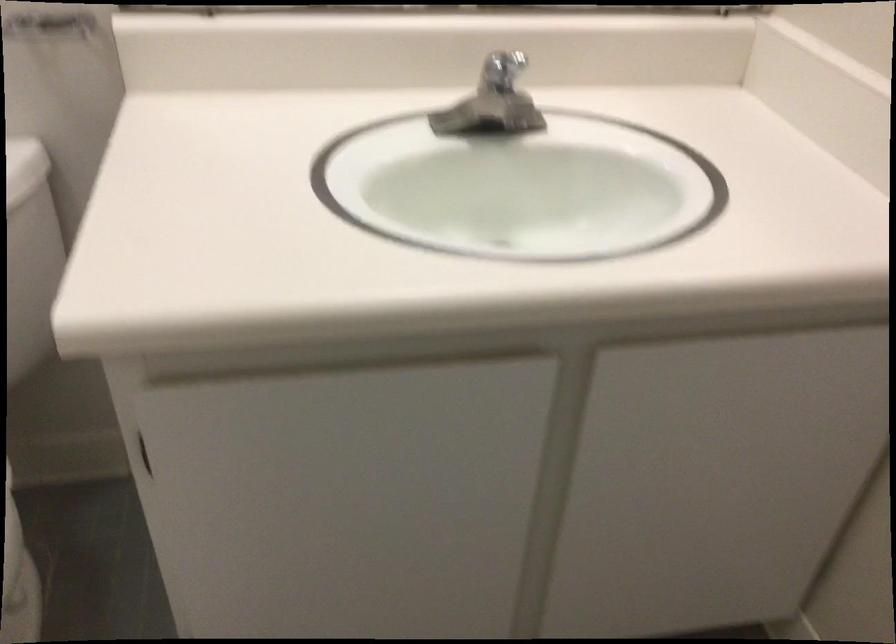
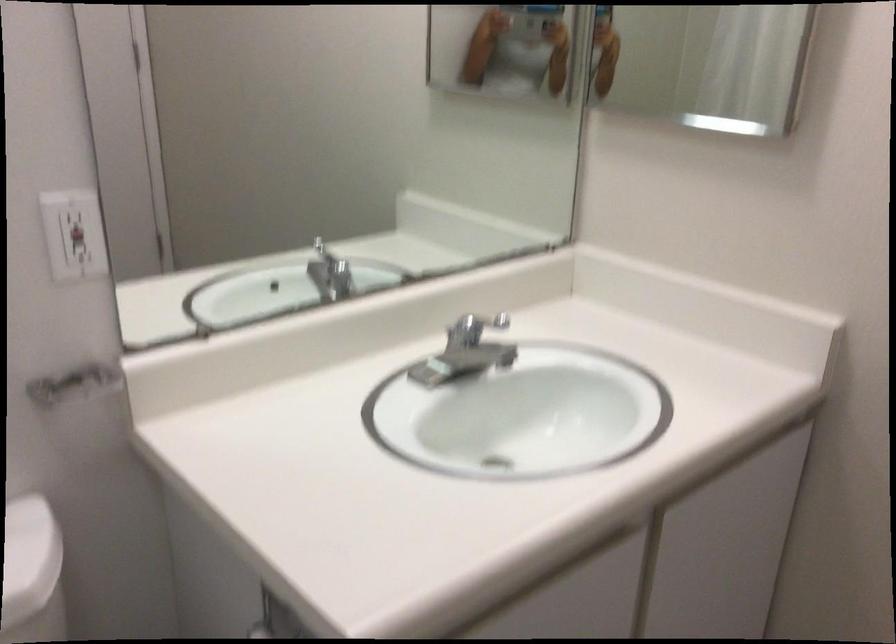
Question: The camera is either moving clockwise (left) or counter-clockwise (right) around the object. The first image is from the beginning of the video and the second image is from the end. Is the camera moving left or right when shooting the video?

Choices:
 (A) Left
 (B) Right

Answer: (A)